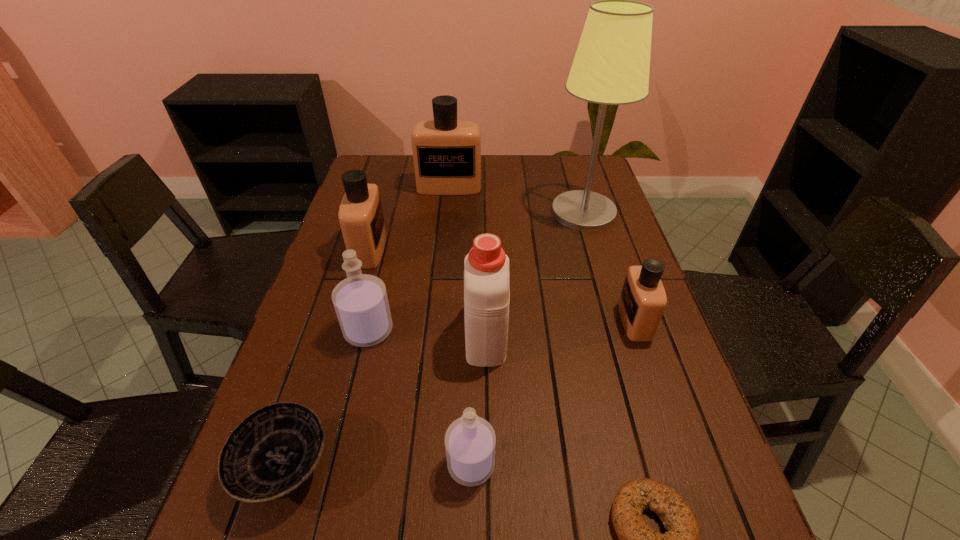
This screenshot has height=540, width=960. I want to click on vacant point at the right edge, so click(735, 515).

Locate an element on the screen. free location at the far left corner is located at coordinates pos(367,164).

In order to click on free space between the farther purple perfume and the detergent in this screenshot , I will do `click(427, 332)`.

This screenshot has width=960, height=540. I want to click on free point between the smallest beige perfume and the tallest object, so 609,266.

Where is `vacant area that lies between the farther purple perfume and the right purple perfume`? vacant area that lies between the farther purple perfume and the right purple perfume is located at coordinates (420, 397).

This screenshot has width=960, height=540. Identify the location of vacant space that's between the second smallest beige perfume and the tallest object. (476, 231).

Where is `free spot between the nearer purple perfume and the eighth tallest object`? free spot between the nearer purple perfume and the eighth tallest object is located at coordinates (378, 467).

Locate an element on the screen. Image resolution: width=960 pixels, height=540 pixels. free space between the bowl and the table lamp is located at coordinates (434, 340).

Locate an element on the screen. free point between the detergent and the rightmost perfume is located at coordinates (561, 327).

You are a GUI agent. You are given a task and a screenshot of the screen. Output one action in this format:
    pyautogui.click(x=<x>, y=<y>)
    Task: Click on the object that stands as the fourth closest to the second biggest beige perfume
    The width and height of the screenshot is (960, 540).
    Given the screenshot: What is the action you would take?
    pyautogui.click(x=272, y=453)